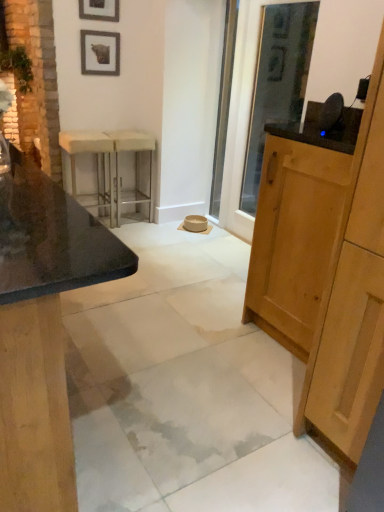
Question: In the image, is wooden picture frame at upper center, the 2th picture frame from the top, positioned in front of or behind white fabric stool at left?

Choices:
 (A) behind
 (B) front

Answer: (A)

Question: From the image's perspective, is wooden picture frame at upper center, the 2th picture frame from the top, located above or below white fabric stool at left?

Choices:
 (A) below
 (B) above

Answer: (B)

Question: Which of these objects is positioned farthest from the matte stone barstools at left, which is counted as the second cabinetry, starting from the right?

Choices:
 (A) matte black picture frame at upper left, marked as the 2th picture frame in a bottom-to-top arrangement
 (B) light brown wood cabinet at right, the first cabinetry when ordered from right to left
 (C) clear glass screen door at center
 (D) wooden picture frame at upper center, the 1th picture frame from the bottom
 (E) white fabric stool at left

Answer: (C)

Question: Which is nearer to the clear glass screen door at center?

Choices:
 (A) white marble concrete at center
 (B) matte black picture frame at upper left, marked as the 1th picture frame in a top-to-bottom arrangement
 (C) matte stone barstools at left, which is counted as the second cabinetry, starting from the right
 (D) metallic silver bar stool at center
 (E) white fabric stool at left

Answer: (D)